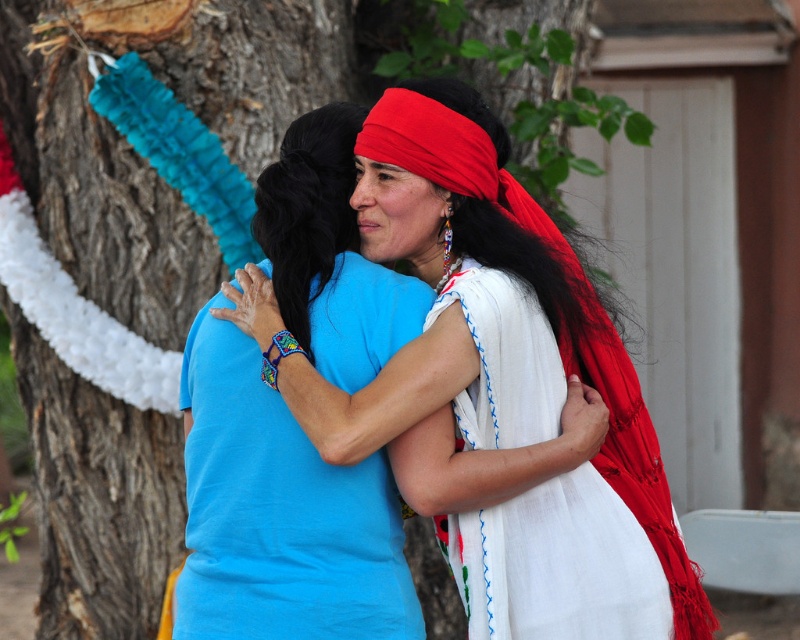
Question: Among these objects, which one is nearest to the camera?

Choices:
 (A) white embroidered dress at center
 (B) black silky hair at center

Answer: (A)

Question: Which object appears farthest from the camera in this image?

Choices:
 (A) matte blue t-shirt at center
 (B) black silky hair at center
 (C) white embroidered dress at center

Answer: (B)

Question: Considering the relative positions of white embroidered dress at center and black silky hair at center in the image provided, where is white embroidered dress at center located with respect to black silky hair at center?

Choices:
 (A) below
 (B) above

Answer: (A)

Question: Which object is closer to the camera taking this photo?

Choices:
 (A) white embroidered dress at center
 (B) matte blue t-shirt at center
 (C) black silky hair at center

Answer: (A)

Question: In this image, where is matte blue t-shirt at center located relative to black silky hair at center?

Choices:
 (A) left
 (B) right

Answer: (B)

Question: Does matte blue t-shirt at center have a greater width compared to black silky hair at center?

Choices:
 (A) no
 (B) yes

Answer: (B)